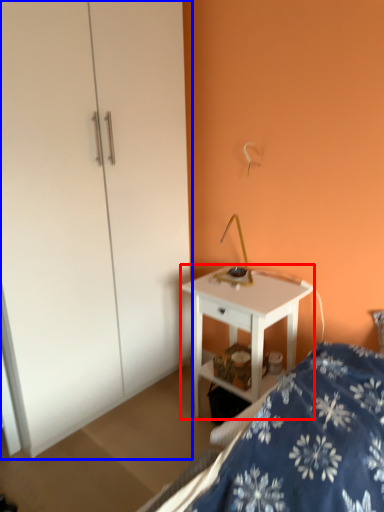
Question: Which object appears farthest to the camera in this image, desk (highlighted by a red box) or dresser (highlighted by a blue box)?

Choices:
 (A) desk
 (B) dresser

Answer: (A)